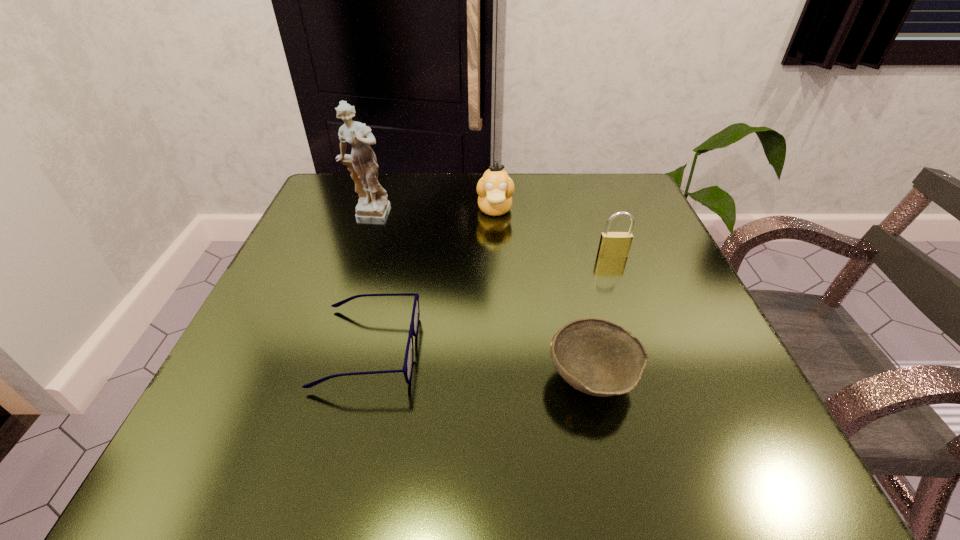
You are a GUI agent. You are given a task and a screenshot of the screen. Output one action in this format:
    pyautogui.click(x=<x>, y=<y>)
    Task: Click on the vacant space positioned 0.120m on the front-facing side of the shortest object
    The width and height of the screenshot is (960, 540).
    Given the screenshot: What is the action you would take?
    tap(492, 348)

The height and width of the screenshot is (540, 960). Find the location of `figurine that is positioned at the far edge`. figurine that is positioned at the far edge is located at coordinates (373, 208).

Where is `duckling that is at the far edge`? This screenshot has height=540, width=960. duckling that is at the far edge is located at coordinates (495, 188).

This screenshot has width=960, height=540. Identify the location of object positioned at the near edge. (595, 356).

Image resolution: width=960 pixels, height=540 pixels. I want to click on figurine that is at the left edge, so click(x=373, y=208).

This screenshot has width=960, height=540. I want to click on spectacles that is at the left edge, so click(407, 369).

This screenshot has height=540, width=960. What are the coordinates of `padlock present at the right edge` in the screenshot? It's located at (612, 244).

At what (x,y) coordinates should I click in order to perform the action: click on bowl located at the right edge. Please return your answer as a coordinate pair (x, y). This screenshot has height=540, width=960. Looking at the image, I should click on (595, 356).

Where is `object situated at the far left corner`? This screenshot has height=540, width=960. object situated at the far left corner is located at coordinates (373, 208).

You are a GUI agent. You are given a task and a screenshot of the screen. Output one action in this format:
    pyautogui.click(x=<x>, y=<y>)
    Task: Click on the object situated at the near right corner
    The width and height of the screenshot is (960, 540).
    Given the screenshot: What is the action you would take?
    pyautogui.click(x=595, y=356)